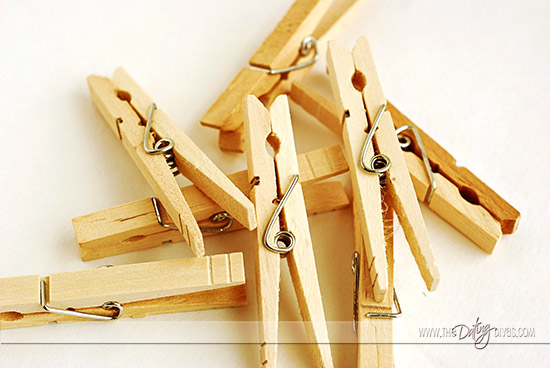
Where is `table`? The height and width of the screenshot is (368, 550). table is located at coordinates (45, 149).